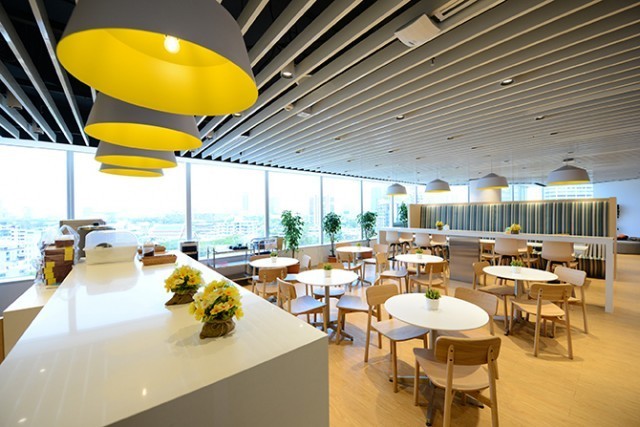
The image size is (640, 427). I want to click on pendant lights, so click(189, 65), click(146, 134), click(132, 159), click(125, 171), click(573, 175), click(491, 180), click(435, 189), click(395, 192).